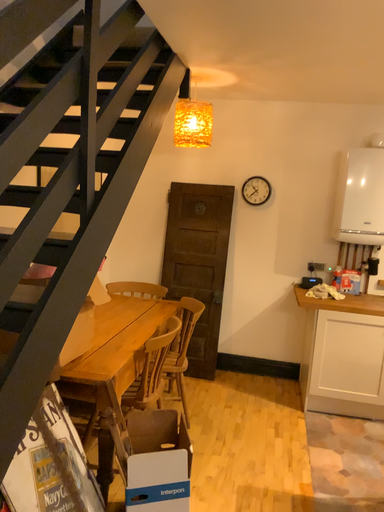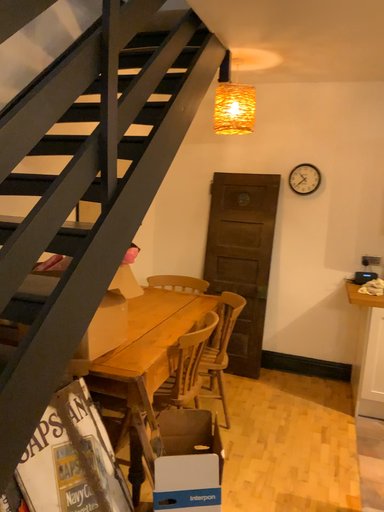
Question: Which way did the camera rotate in the video?

Choices:
 (A) rotated left
 (B) rotated right

Answer: (A)